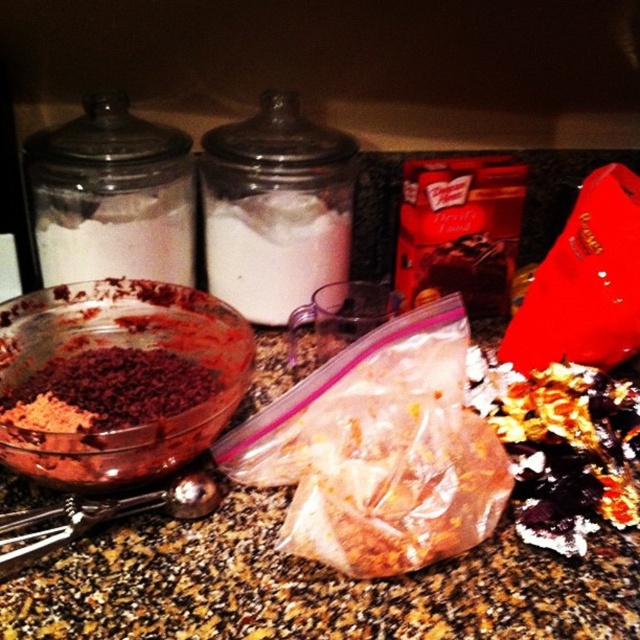
What is located at the coordinate point (116, 380) in the kitchen scene?

The translucent glass bowl at center left is located at the coordinate point (116, 380).